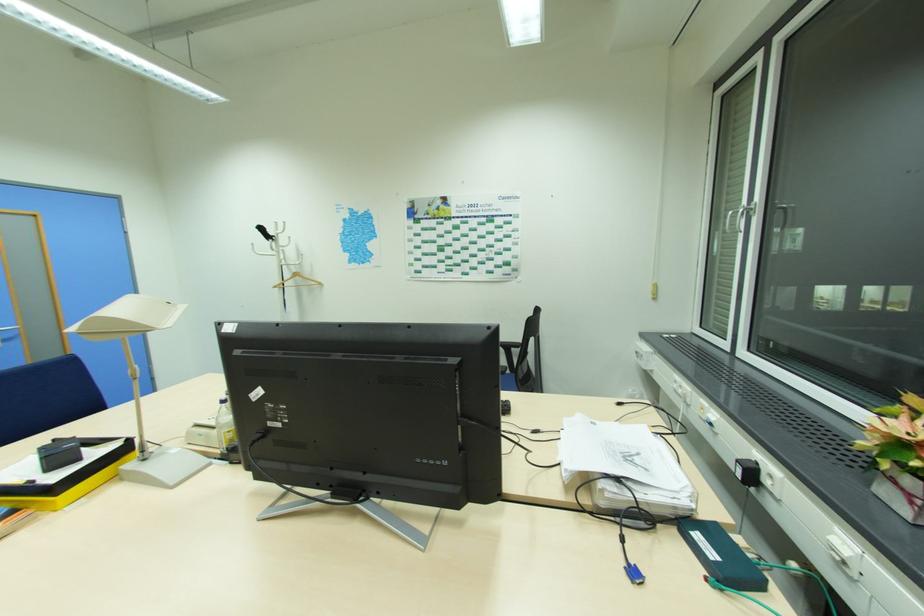
This screenshot has width=924, height=616. What do you see at coordinates (14, 328) in the screenshot?
I see `the silver door handle` at bounding box center [14, 328].